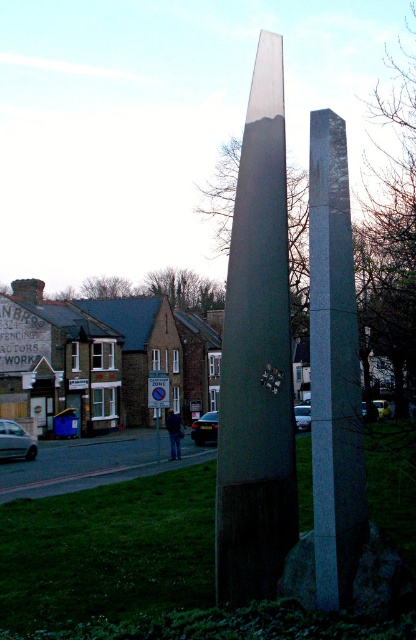
Question: Which of the following is the farthest from the observer?

Choices:
 (A) 269,388
 (B) 336,508

Answer: (A)

Question: Is metallic polished obelisk at center wider than granite stone obelisk at center?

Choices:
 (A) no
 (B) yes

Answer: (B)

Question: Can you confirm if metallic polished obelisk at center is bigger than granite stone obelisk at center?

Choices:
 (A) yes
 (B) no

Answer: (B)

Question: Does metallic polished obelisk at center appear over granite stone obelisk at center?

Choices:
 (A) no
 (B) yes

Answer: (A)

Question: Which point appears closest to the camera in this image?

Choices:
 (A) (245, 132)
 (B) (349, 280)

Answer: (B)